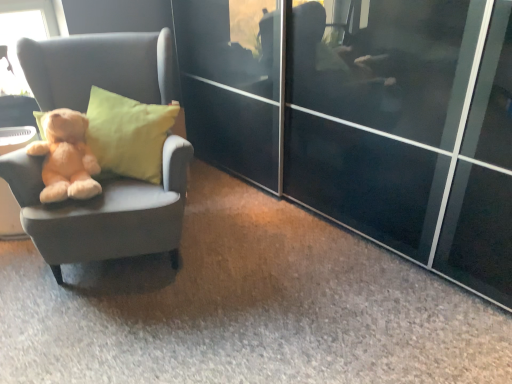
Question: Should I look upward or downward to see soft plush teddy bear at left?

Choices:
 (A) up
 (B) down

Answer: (A)

Question: Can you confirm if soft plush teddy bear at left is taller than matte gray chair at left?

Choices:
 (A) no
 (B) yes

Answer: (A)

Question: Is soft plush teddy bear at left positioned behind matte gray chair at left?

Choices:
 (A) no
 (B) yes

Answer: (B)

Question: Is soft plush teddy bear at left located outside matte gray chair at left?

Choices:
 (A) yes
 (B) no

Answer: (B)

Question: Can you confirm if soft plush teddy bear at left is smaller than matte gray chair at left?

Choices:
 (A) no
 (B) yes

Answer: (B)

Question: From a real-world perspective, is soft plush teddy bear at left beneath matte gray chair at left?

Choices:
 (A) no
 (B) yes

Answer: (A)

Question: From a real-world perspective, is soft plush teddy bear at left over matte gray chair at left?

Choices:
 (A) yes
 (B) no

Answer: (A)

Question: Does matte gray chair at left appear on the right side of soft plush teddy bear at left?

Choices:
 (A) no
 (B) yes

Answer: (B)

Question: Does matte gray chair at left lie behind soft plush teddy bear at left?

Choices:
 (A) yes
 (B) no

Answer: (B)

Question: From a real-world perspective, is matte gray chair at left under soft plush teddy bear at left?

Choices:
 (A) yes
 (B) no

Answer: (A)

Question: Is matte gray chair at left aimed at soft plush teddy bear at left?

Choices:
 (A) yes
 (B) no

Answer: (A)

Question: Is matte gray chair at left touching soft plush teddy bear at left?

Choices:
 (A) no
 (B) yes

Answer: (A)

Question: Is the depth of matte gray chair at left less than that of soft plush teddy bear at left?

Choices:
 (A) no
 (B) yes

Answer: (B)

Question: Based on their sizes in the image, would you say matte gray chair at left is bigger or smaller than soft plush teddy bear at left?

Choices:
 (A) big
 (B) small

Answer: (A)